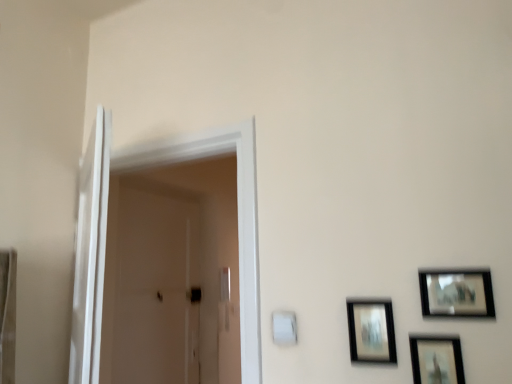
Describe the element at coordinates (90, 254) in the screenshot. I see `white glossy screen door at left, the 1th screen door positioned from the front` at that location.

This screenshot has width=512, height=384. What are the coordinates of `white glossy door at left` in the screenshot? It's located at (106, 231).

Measure the distance between white plastic light switch at lower center and camera.

They are 1.37 meters apart.

Where is `white glossy screen door at left, the 2th screen door viewed from the back`? white glossy screen door at left, the 2th screen door viewed from the back is located at coordinates (90, 254).

How different are the orientations of white glossy door at left, the 2th screen door in the front-to-back sequence, and white plastic light switch at lower center in degrees?

white glossy door at left, the 2th screen door in the front-to-back sequence, and white plastic light switch at lower center are facing 90.4 degrees away from each other.

How much distance is there between white glossy door at left, the 2th screen door in the front-to-back sequence, and white plastic light switch at lower center?

white glossy door at left, the 2th screen door in the front-to-back sequence, and white plastic light switch at lower center are 1.33 meters apart from each other.

Does white glossy door at left, placed as the first screen door when sorted from back to front, have a lesser height compared to white plastic light switch at lower center?

No, white glossy door at left, placed as the first screen door when sorted from back to front, is not shorter than white plastic light switch at lower center.

Which is in front, white glossy door at left, the 2th screen door in the front-to-back sequence, or white plastic light switch at lower center?

white plastic light switch at lower center is closer to the camera.

From a real-world perspective, is matte black picture frame at lower right, the second picture frame viewed from the left, beneath white plastic light switch at lower center?

Yes, from a real-world perspective, matte black picture frame at lower right, the second picture frame viewed from the left, is beneath white plastic light switch at lower center.

Which is in front, point (413, 379) or point (291, 340)?

The point (413, 379) is more forward.

What's the angular difference between matte black picture frame at lower right, the second picture frame viewed from the left, and white plastic light switch at lower center's facing directions?

There is a 0.883-degree angle between the facing directions of matte black picture frame at lower right, the second picture frame viewed from the left, and white plastic light switch at lower center.

Starting from the white glossy door at left, placed as the first screen door when sorted from back to front, which picture frame is the 2nd one to the right? Please provide its 2D coordinates.

[(436, 359)]

Can you confirm if white glossy door at left, placed as the first screen door when sorted from back to front, is thinner than matte black picture frame at lower right, marked as the second picture frame in a right-to-left arrangement?

In fact, white glossy door at left, placed as the first screen door when sorted from back to front, might be wider than matte black picture frame at lower right, marked as the second picture frame in a right-to-left arrangement.

From the image's perspective, is white glossy door at left, the 2th screen door in the front-to-back sequence, positioned above or below matte black picture frame at lower right, the second picture frame viewed from the left?

white glossy door at left, the 2th screen door in the front-to-back sequence, is below matte black picture frame at lower right, the second picture frame viewed from the left.

Is white glossy door at left, the 2th screen door in the front-to-back sequence, completely or partially outside of matte black picture frame at lower right, marked as the second picture frame in a right-to-left arrangement?

white glossy door at left, the 2th screen door in the front-to-back sequence, lies outside matte black picture frame at lower right, marked as the second picture frame in a right-to-left arrangement,'s area.

Considering the sizes of white glossy door at left and matte black picture frame at lower right, the second picture frame viewed from the left, in the image, is white glossy door at left bigger or smaller than matte black picture frame at lower right, the second picture frame viewed from the left,?

white glossy door at left is bigger than matte black picture frame at lower right, the second picture frame viewed from the left.

Can you tell me how much white glossy door at left and matte black picture frame at lower right, the second picture frame viewed from the left, differ in facing direction?

2.34 degrees.

Considering the relative positions of white glossy door at left and matte black picture frame at lower right, the second picture frame viewed from the left, in the image provided, is white glossy door at left to the right of matte black picture frame at lower right, the second picture frame viewed from the left, from the viewer's perspective?

Incorrect, white glossy door at left is not on the right side of matte black picture frame at lower right, the second picture frame viewed from the left.

From the matte black picture frame at lower right, the 3th picture frame when ordered from right to left, count 2nd picture frame to the right and point to it. Please provide its 2D coordinates.

[(456, 293)]

Is matte black picture frame at upper right, placed as the first picture frame when sorted from right to left, not inside matte black picture frame at lower right, the 3th picture frame when ordered from right to left?

matte black picture frame at upper right, placed as the first picture frame when sorted from right to left, lies outside matte black picture frame at lower right, the 3th picture frame when ordered from right to left,'s area.

Could you tell me if matte black picture frame at upper right, placed as the first picture frame when sorted from right to left, is facing matte black picture frame at lower right, the 3th picture frame when ordered from right to left?

No, matte black picture frame at upper right, placed as the first picture frame when sorted from right to left, is not oriented towards matte black picture frame at lower right, the 3th picture frame when ordered from right to left.

From the image's perspective, which is above, matte black picture frame at upper right, which is counted as the third picture frame, starting from the left, or white plastic light switch at lower center?

From the image's view, matte black picture frame at upper right, which is counted as the third picture frame, starting from the left, is above.

Based on the photo, between matte black picture frame at upper right, placed as the first picture frame when sorted from right to left, and white plastic light switch at lower center, which one appears on the left side from the viewer's perspective?

white plastic light switch at lower center is more to the left.

From a real-world perspective, is matte black picture frame at upper right, which is counted as the third picture frame, starting from the left, physically above white plastic light switch at lower center?

Yes.

You are a GUI agent. You are given a task and a screenshot of the screen. Output one action in this format:
    pyautogui.click(x=<x>, y=<y>)
    Task: Click on the light switch below the matte black picture frame at upper right, placed as the first picture frame when sorted from right to left (from the image's perspective)
    Image resolution: width=512 pixels, height=384 pixels.
    Given the screenshot: What is the action you would take?
    pyautogui.click(x=284, y=328)

What's the angular difference between matte black picture frame at lower right, placed as the first picture frame when sorted from left to right, and white plastic light switch at lower center's facing directions?

They differ by 0.883 degrees in their facing directions.

How far apart are matte black picture frame at lower right, the 3th picture frame when ordered from right to left, and white plastic light switch at lower center?

A distance of 9.42 inches exists between matte black picture frame at lower right, the 3th picture frame when ordered from right to left, and white plastic light switch at lower center.

Is the depth of matte black picture frame at lower right, placed as the first picture frame when sorted from left to right, less than that of white plastic light switch at lower center?

Yes, it is.

Are matte black picture frame at lower right, placed as the first picture frame when sorted from left to right, and white plastic light switch at lower center located far from each other?

No, matte black picture frame at lower right, placed as the first picture frame when sorted from left to right, is not far from white plastic light switch at lower center.

This screenshot has width=512, height=384. I want to click on screen door behind the white plastic light switch at lower center, so click(151, 287).

What are the coordinates of `picture frame located below the white plastic light switch at lower center (from the image's perspective)` in the screenshot? It's located at (436, 359).

Looking at the image, which one is located further to white glossy door at left, white plastic light switch at lower center or matte black picture frame at lower right, the 3th picture frame when ordered from right to left?

Among the two, matte black picture frame at lower right, the 3th picture frame when ordered from right to left, is located further to white glossy door at left.

Looking at this image, looking at the image, which one is located closer to matte black picture frame at upper right, which is counted as the third picture frame, starting from the left, white glossy door at left, placed as the first screen door when sorted from back to front, or matte black picture frame at lower right, marked as the second picture frame in a right-to-left arrangement?

matte black picture frame at lower right, marked as the second picture frame in a right-to-left arrangement, is positioned closer to the anchor matte black picture frame at upper right, which is counted as the third picture frame, starting from the left.

Looking at the image, which one is located closer to white plastic light switch at lower center, white glossy door at left or matte black picture frame at lower right, placed as the first picture frame when sorted from left to right?

matte black picture frame at lower right, placed as the first picture frame when sorted from left to right, is positioned closer to the anchor white plastic light switch at lower center.

Considering their positions, is matte black picture frame at lower right, placed as the first picture frame when sorted from left to right, positioned further to matte black picture frame at lower right, the second picture frame viewed from the left, than white glossy door at left?

white glossy door at left is positioned further to the anchor matte black picture frame at lower right, the second picture frame viewed from the left.

Based on their spatial positions, is matte black picture frame at lower right, placed as the first picture frame when sorted from left to right, or white glossy door at left closer to white plastic light switch at lower center?

matte black picture frame at lower right, placed as the first picture frame when sorted from left to right, lies closer to white plastic light switch at lower center than the other object.

Which object lies further to the anchor point matte black picture frame at lower right, placed as the first picture frame when sorted from left to right, white glossy screen door at left, the 2th screen door viewed from the back, or white glossy door at left?

white glossy screen door at left, the 2th screen door viewed from the back, is further to matte black picture frame at lower right, placed as the first picture frame when sorted from left to right.

Based on their spatial positions, is white glossy screen door at left, the 2th screen door viewed from the back, or white plastic light switch at lower center closer to matte black picture frame at lower right, the 3th picture frame when ordered from right to left?

white plastic light switch at lower center is closer to matte black picture frame at lower right, the 3th picture frame when ordered from right to left.

Which object lies further to the anchor point matte black picture frame at lower right, the second picture frame viewed from the left, white glossy screen door at left, the 2th screen door viewed from the back, or matte black picture frame at lower right, the 3th picture frame when ordered from right to left?

Among the two, white glossy screen door at left, the 2th screen door viewed from the back, is located further to matte black picture frame at lower right, the second picture frame viewed from the left.

The width and height of the screenshot is (512, 384). I want to click on door between white glossy screen door at left, the 2th screen door viewed from the back, and matte black picture frame at lower right, the 3th picture frame when ordered from right to left, from left to right, so click(106, 231).

Where is `door situated between white glossy screen door at left, the 1th screen door positioned from the front, and matte black picture frame at lower right, the second picture frame viewed from the left, from left to right`? Image resolution: width=512 pixels, height=384 pixels. door situated between white glossy screen door at left, the 1th screen door positioned from the front, and matte black picture frame at lower right, the second picture frame viewed from the left, from left to right is located at coordinates (106, 231).

Locate an element on the screen. Image resolution: width=512 pixels, height=384 pixels. screen door between white glossy screen door at left, the 2th screen door viewed from the back, and matte black picture frame at upper right, which is counted as the third picture frame, starting from the left, in the horizontal direction is located at coordinates (151, 287).

Identify the location of door between white glossy door at left, placed as the first screen door when sorted from back to front, and matte black picture frame at lower right, the second picture frame viewed from the left, from left to right. (106, 231).